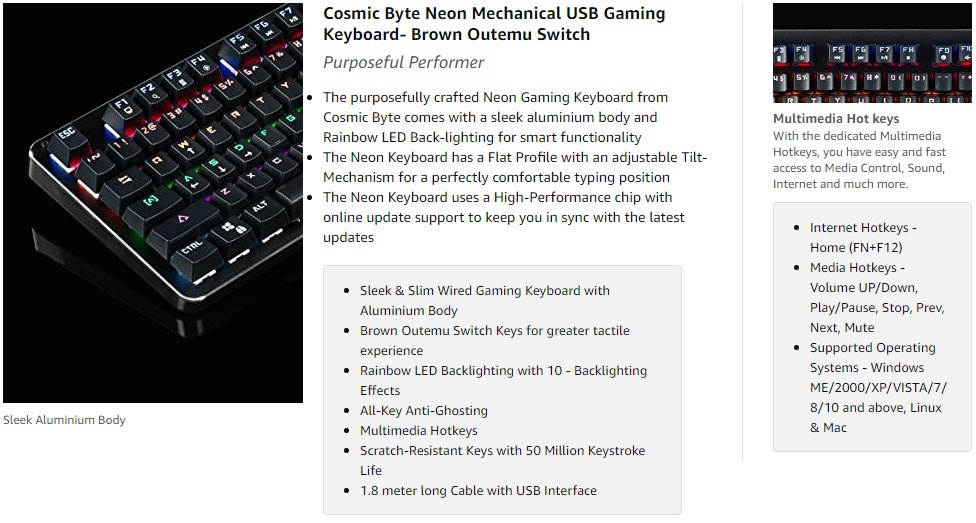
Find the location of a particular element. The width and height of the screenshot is (976, 523). keyboard photo is located at coordinates (113, 241), (791, 68).